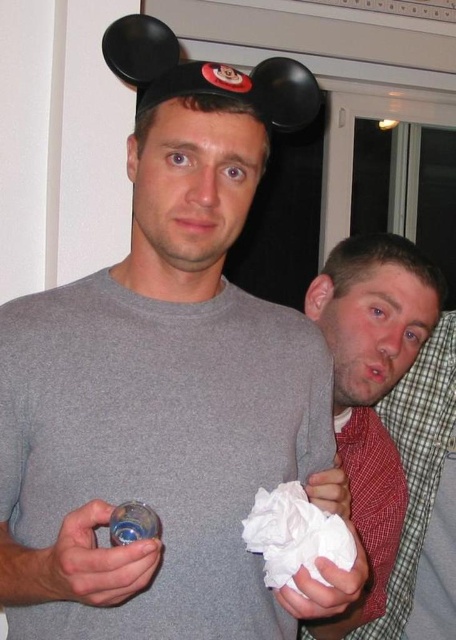
Is red plaid tie at right bigger than white crumpled paper at lower center?

Yes.

What do you see at coordinates (372, 387) in the screenshot?
I see `red plaid tie at right` at bounding box center [372, 387].

Locate an element on the screen. red plaid tie at right is located at coordinates (372, 387).